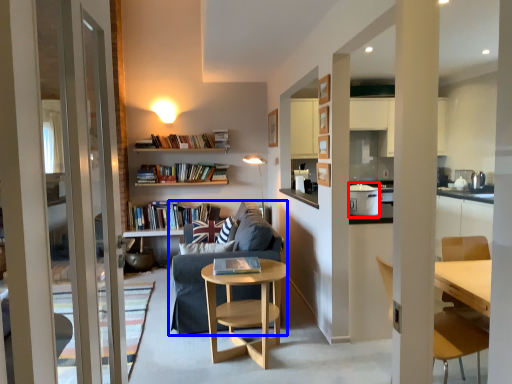
Question: Among these objects, which one is farthest to the camera, appliance (highlighted by a red box) or studio couch (highlighted by a blue box)?

Choices:
 (A) appliance
 (B) studio couch

Answer: (B)